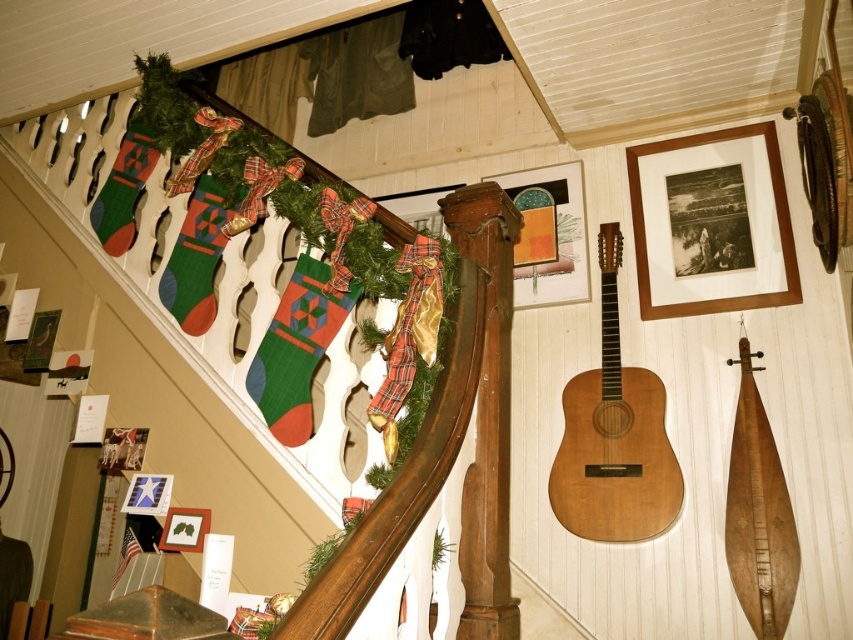
Question: Which of the following is the farthest from the observer?

Choices:
 (A) tap(759, 426)
 (B) tap(599, 385)
 (C) tap(648, 276)

Answer: (C)

Question: Which is nearer to the wooden guitar at center-right?

Choices:
 (A) natural wood guitar at center
 (B) wooden picture frame at upper right

Answer: (A)

Question: Is wooden guitar at center-right positioned behind wooden picture frame at upper right?

Choices:
 (A) no
 (B) yes

Answer: (A)

Question: Does natural wood guitar at center lie behind wooden picture frame at upper right?

Choices:
 (A) yes
 (B) no

Answer: (B)

Question: Which point is closer to the camera taking this photo?

Choices:
 (A) (775, 532)
 (B) (653, 314)

Answer: (A)

Question: Is wooden guitar at center-right thinner than wooden picture frame at upper right?

Choices:
 (A) yes
 (B) no

Answer: (A)